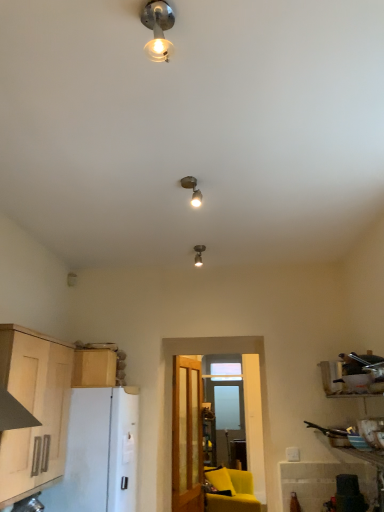
What do you see at coordinates (84, 455) in the screenshot?
I see `white matte refrigerator at left` at bounding box center [84, 455].

Describe the element at coordinates (199, 254) in the screenshot. Image resolution: width=384 pixels, height=512 pixels. I see `matte silver spotlight at center, the 3th lamp when ordered from front to back` at that location.

Measure the distance between matte silver spotlight at center, the 3th lamp when ordered from front to back, and camera.

3.09 meters.

How much space does light wood cabinet at upper left, the second cabinetry positioned from the front, occupy vertically?

light wood cabinet at upper left, the second cabinetry positioned from the front, is 11.71 inches in height.

Describe the element at coordinates (94, 368) in the screenshot. I see `light wood cabinet at upper left, the 1th cabinetry from the back` at that location.

What do you see at coordinates (207, 442) in the screenshot?
I see `clear glass door at center` at bounding box center [207, 442].

Find the location of a particular element. The width and height of the screenshot is (384, 512). matte yellow armchair at lower center is located at coordinates [233, 492].

The width and height of the screenshot is (384, 512). What do you see at coordinates (233, 492) in the screenshot?
I see `matte yellow armchair at lower center` at bounding box center [233, 492].

The image size is (384, 512). Describe the element at coordinates (192, 189) in the screenshot. I see `satin silver spotlight at center, which is counted as the second lamp, starting from the back` at that location.

The height and width of the screenshot is (512, 384). Describe the element at coordinates (224, 404) in the screenshot. I see `transparent glass window at center` at that location.

This screenshot has height=512, width=384. Find the location of `light wood cabinet at left, which ranks as the first cabinetry in front-to-back order`. light wood cabinet at left, which ranks as the first cabinetry in front-to-back order is located at coordinates (34, 410).

Describe the element at coordinates (34, 410) in the screenshot. This screenshot has width=384, height=512. I see `light wood cabinet at left, which ranks as the first cabinetry in front-to-back order` at that location.

Where is `white matte refrigerator at left`? white matte refrigerator at left is located at coordinates (84, 455).

Can you tell me how much light wood cabinet at left, which ranks as the first cabinetry in front-to-back order, and satin silver spotlight at center, the second lamp when ordered from front to back, differ in facing direction?

The angle between the facing direction of light wood cabinet at left, which ranks as the first cabinetry in front-to-back order, and the facing direction of satin silver spotlight at center, the second lamp when ordered from front to back, is 98.4 degrees.

Can we say light wood cabinet at left, arranged as the 2th cabinetry when viewed from the back, lies outside satin silver spotlight at center, which is counted as the second lamp, starting from the back?

Yes, light wood cabinet at left, arranged as the 2th cabinetry when viewed from the back, is located beyond the bounds of satin silver spotlight at center, which is counted as the second lamp, starting from the back.

Considering the relative sizes of light wood cabinet at left, which ranks as the first cabinetry in front-to-back order, and satin silver spotlight at center, which is counted as the second lamp, starting from the back, in the image provided, is light wood cabinet at left, which ranks as the first cabinetry in front-to-back order, bigger than satin silver spotlight at center, which is counted as the second lamp, starting from the back,?

Yes.

From a real-world perspective, is light wood cabinet at left, which ranks as the first cabinetry in front-to-back order, located beneath satin silver spotlight at center, which ranks as the 2th lamp in bottom-to-top order?

Correct, in the physical world, light wood cabinet at left, which ranks as the first cabinetry in front-to-back order, is lower than satin silver spotlight at center, which ranks as the 2th lamp in bottom-to-top order.

Where is `appliance in front of the clear glass door at center`? The width and height of the screenshot is (384, 512). appliance in front of the clear glass door at center is located at coordinates (84, 455).

Does point (258, 446) lie in front of point (113, 496)?

No, (258, 446) is behind (113, 496).

Between clear glass door at center and white matte refrigerator at left, which one is positioned in front?

white matte refrigerator at left is closer to the camera.

From a real-world perspective, does clear glass door at center sit lower than light wood cabinet at left, arranged as the 2th cabinetry when viewed from the back?

Yes, from a real-world perspective, clear glass door at center is under light wood cabinet at left, arranged as the 2th cabinetry when viewed from the back.

Locate an element on the screen. The width and height of the screenshot is (384, 512). cabinetry that is the 2nd object to the left of the clear glass door at center, starting at the anchor is located at coordinates (34, 410).

Considering the sizes of objects clear glass door at center and light wood cabinet at left, which ranks as the first cabinetry in front-to-back order, in the image provided, who is bigger, clear glass door at center or light wood cabinet at left, which ranks as the first cabinetry in front-to-back order,?

Bigger between the two is light wood cabinet at left, which ranks as the first cabinetry in front-to-back order.

Is point (189, 358) farther from viewer compared to point (35, 444)?

Yes, point (189, 358) is farther from viewer.

Is light wood cabinet at upper left, the 1th cabinetry from the back, not within matte yellow armchair at lower center?

Yes, light wood cabinet at upper left, the 1th cabinetry from the back, is located beyond the bounds of matte yellow armchair at lower center.

From the image's perspective, would you say light wood cabinet at upper left, the second cabinetry positioned from the front, is shown under matte yellow armchair at lower center?

No.

Is light wood cabinet at upper left, the 1th cabinetry from the back, thinner than matte yellow armchair at lower center?

Yes.

Based on their sizes in the image, would you say light wood cabinet at upper left, the second cabinetry positioned from the front, is bigger or smaller than matte yellow armchair at lower center?

light wood cabinet at upper left, the second cabinetry positioned from the front, is smaller than matte yellow armchair at lower center.

From the image's perspective, which is above, light wood cabinet at left, arranged as the 2th cabinetry when viewed from the back, or white matte refrigerator at left?

From the image's view, light wood cabinet at left, arranged as the 2th cabinetry when viewed from the back, is above.

Can you see light wood cabinet at left, arranged as the 2th cabinetry when viewed from the back, touching white matte refrigerator at left?

light wood cabinet at left, arranged as the 2th cabinetry when viewed from the back, and white matte refrigerator at left are clearly separated.

Can you confirm if light wood cabinet at left, which ranks as the first cabinetry in front-to-back order, is bigger than white matte refrigerator at left?

Actually, light wood cabinet at left, which ranks as the first cabinetry in front-to-back order, might be smaller than white matte refrigerator at left.

Locate an element on the screen. This screenshot has width=384, height=512. appliance that appears behind the light wood cabinet at left, arranged as the 2th cabinetry when viewed from the back is located at coordinates (84, 455).

Considering the relative positions of clear glass door at center and transparent glass window at center in the image provided, is clear glass door at center behind transparent glass window at center?

No, clear glass door at center is in front of transparent glass window at center.

Does clear glass door at center turn towards transparent glass window at center?

No, clear glass door at center does not turn towards transparent glass window at center.

Between point (264, 472) and point (207, 371), which one is positioned behind?

The point (207, 371) is more distant.

From a real-world perspective, is clear glass door at center physically located above or below transparent glass window at center?

Clearly, from a real-world perspective, clear glass door at center is below transparent glass window at center.

Are matte yellow armchair at lower center and light wood cabinet at left, arranged as the 2th cabinetry when viewed from the back, making contact?

They are not placed beside each other.

Who is taller, matte yellow armchair at lower center or light wood cabinet at left, which ranks as the first cabinetry in front-to-back order?

With more height is light wood cabinet at left, which ranks as the first cabinetry in front-to-back order.

From the image's perspective, between matte yellow armchair at lower center and light wood cabinet at left, arranged as the 2th cabinetry when viewed from the back, who is located below?

matte yellow armchair at lower center.

Who is more distant, matte yellow armchair at lower center or light wood cabinet at left, arranged as the 2th cabinetry when viewed from the back?

Positioned behind is matte yellow armchair at lower center.

Find the location of a particular element. Image resolution: width=384 pixels, height=512 pixels. the 2nd lamp counting from the right of the light wood cabinet at left, arranged as the 2th cabinetry when viewed from the back is located at coordinates (192, 189).

Image resolution: width=384 pixels, height=512 pixels. What are the coordinates of `appliance directly beneath the clear glass door at center (from a real-world perspective)` in the screenshot? It's located at (84, 455).

Considering their positions, is metallic bulb at upper center, arranged as the 1th lamp when viewed from the top, positioned further to clear glass door at center than matte silver spotlight at center, which ranks as the 1th lamp in bottom-to-top order?

Based on the image, metallic bulb at upper center, arranged as the 1th lamp when viewed from the top, appears to be further to clear glass door at center.

Based on their spatial positions, is metallic bulb at upper center, arranged as the 1th lamp when viewed from the top, or white matte refrigerator at left further from light wood cabinet at left, which ranks as the first cabinetry in front-to-back order?

metallic bulb at upper center, arranged as the 1th lamp when viewed from the top, is positioned further to the anchor light wood cabinet at left, which ranks as the first cabinetry in front-to-back order.

Considering their positions, is metallic bulb at upper center, positioned as the 3th lamp in back-to-front order, positioned further to satin silver spotlight at center, the second lamp when ordered from front to back, than transparent glass window at center?

transparent glass window at center is positioned further to the anchor satin silver spotlight at center, the second lamp when ordered from front to back.

From the image, which object appears to be farther from matte silver spotlight at center, the 3th lamp when ordered from front to back, light wood cabinet at upper left, the second cabinetry positioned from the front, or satin silver spotlight at center, the second lamp from the top?

The object further to matte silver spotlight at center, the 3th lamp when ordered from front to back, is light wood cabinet at upper left, the second cabinetry positioned from the front.

Considering their positions, is matte silver spotlight at center, which ranks as the 1th lamp in bottom-to-top order, positioned closer to matte yellow armchair at lower center than light wood cabinet at upper left, the second cabinetry positioned from the front?

light wood cabinet at upper left, the second cabinetry positioned from the front, lies closer to matte yellow armchair at lower center than the other object.

From the picture: Which object lies nearer to the anchor point matte silver spotlight at center, the 3th lamp when ordered from front to back, white matte refrigerator at left or matte yellow armchair at lower center?

white matte refrigerator at left is positioned closer to the anchor matte silver spotlight at center, the 3th lamp when ordered from front to back.

In the scene shown: Considering their positions, is light wood cabinet at upper left, the second cabinetry positioned from the front, positioned closer to transparent glass window at center than clear glass door at center?

Based on the image, clear glass door at center appears to be nearer to transparent glass window at center.

From the picture: Based on their spatial positions, is light wood cabinet at upper left, the 1th cabinetry from the back, or matte yellow armchair at lower center closer to light wood cabinet at left, arranged as the 2th cabinetry when viewed from the back?

light wood cabinet at upper left, the 1th cabinetry from the back, lies closer to light wood cabinet at left, arranged as the 2th cabinetry when viewed from the back, than the other object.

The height and width of the screenshot is (512, 384). Identify the location of armchair between light wood cabinet at upper left, the second cabinetry positioned from the front, and transparent glass window at center, along the z-axis. (233, 492).

Locate an element on the screen. The height and width of the screenshot is (512, 384). appliance that lies between metallic bulb at upper center, positioned as the 1th lamp in front-to-back order, and matte yellow armchair at lower center from top to bottom is located at coordinates (84, 455).

I want to click on glass door between metallic bulb at upper center, arranged as the 1th lamp when viewed from the top, and transparent glass window at center in the front-back direction, so click(207, 442).

Image resolution: width=384 pixels, height=512 pixels. Find the location of `appliance situated between light wood cabinet at upper left, the 1th cabinetry from the back, and clear glass door at center from left to right`. appliance situated between light wood cabinet at upper left, the 1th cabinetry from the back, and clear glass door at center from left to right is located at coordinates (84, 455).